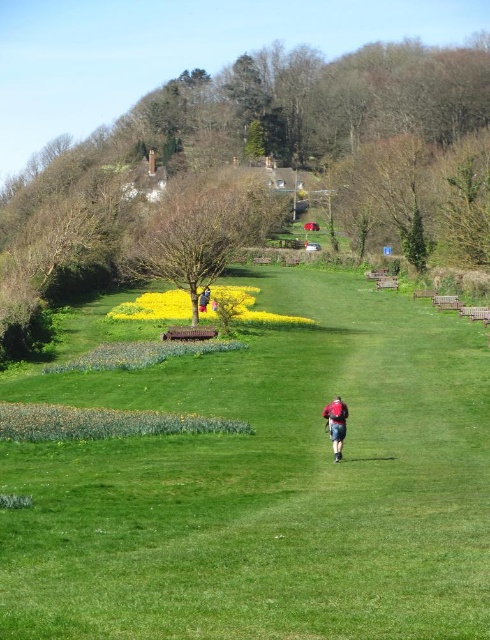
Question: Which point appears closest to the camera in this image?

Choices:
 (A) (335, 451)
 (B) (218, 273)
 (C) (339, 556)

Answer: (C)

Question: Can you confirm if green grassy at center is thinner than red fabric shirt at center?

Choices:
 (A) yes
 (B) no

Answer: (B)

Question: Which point is farther to the camera?

Choices:
 (A) yellow matte flower at center
 (B) bare wood tree at center

Answer: (B)

Question: Considering the relative positions of green leafy tree at center and yellow matte flower at center in the image provided, where is green leafy tree at center located with respect to yellow matte flower at center?

Choices:
 (A) right
 (B) left

Answer: (A)

Question: Which is farther from the green leafy tree at center?

Choices:
 (A) yellow matte flower at center
 (B) bare wood tree at center
 (C) green grassy at center
 (D) red fabric shirt at center

Answer: (D)

Question: Is bare wood tree at center behind red fabric shirt at center?

Choices:
 (A) yes
 (B) no

Answer: (A)